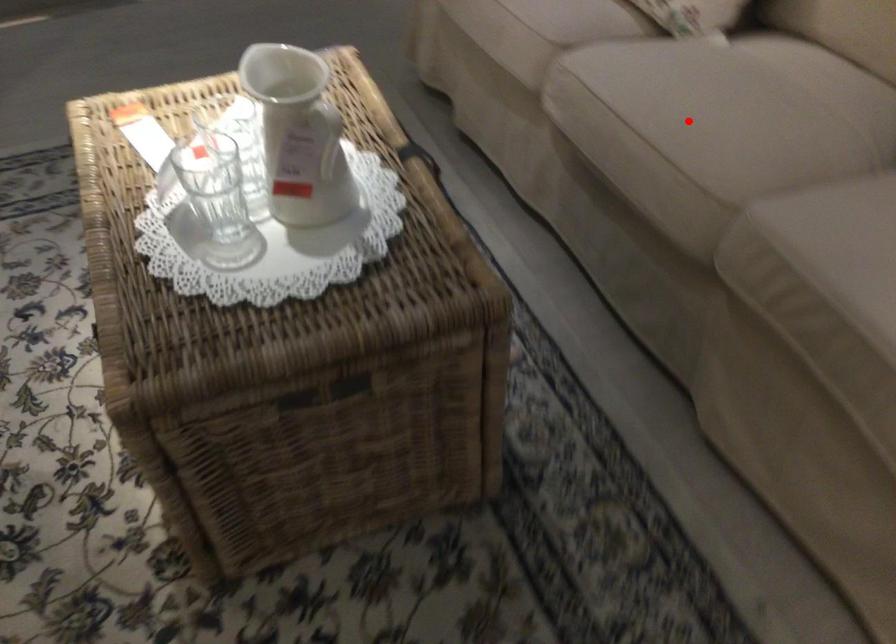
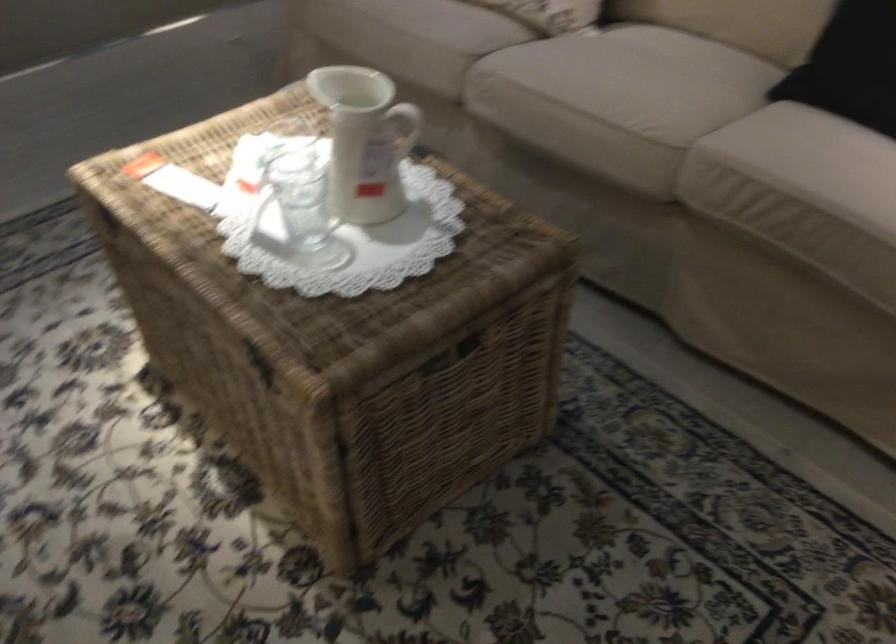
In the second image, find the point that corresponds to the highlighted location in the first image.

(617, 93)